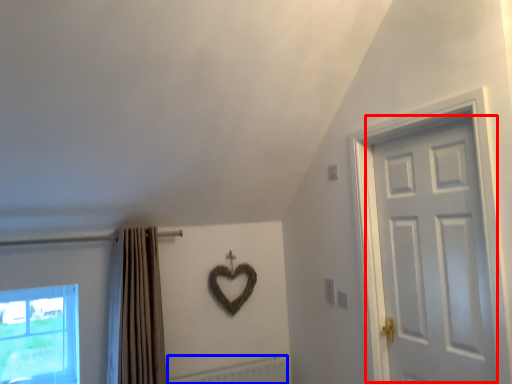
Question: Among these objects, which one is nearest to the camera, door (highlighted by a red box) or radiator (highlighted by a blue box)?

Choices:
 (A) door
 (B) radiator

Answer: (A)